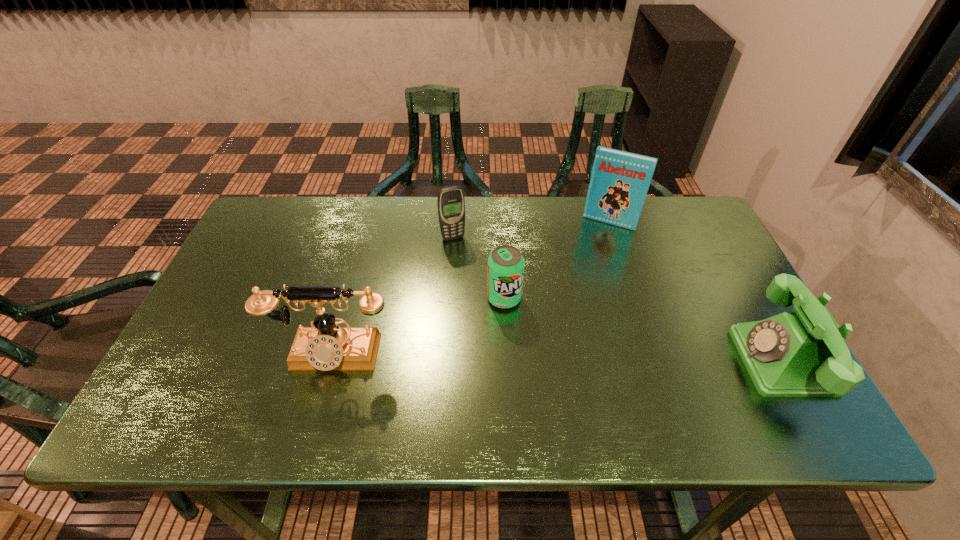
This screenshot has width=960, height=540. In order to click on vacant point located 0.070m on the dial of the shorter telephone in this screenshot , I will do `click(710, 361)`.

This screenshot has height=540, width=960. I want to click on vacant space located on the dial of the shorter telephone, so click(x=715, y=361).

In order to click on free space located on the dial of the shorter telephone in this screenshot , I will do `click(625, 361)`.

Find the location of a particular element. This screenshot has height=540, width=960. free point located on the screen of the second farthest object is located at coordinates (468, 267).

Where is `free space located 0.120m on the screen of the second farthest object`? free space located 0.120m on the screen of the second farthest object is located at coordinates (469, 269).

Image resolution: width=960 pixels, height=540 pixels. I want to click on vacant region located on the screen of the second farthest object, so click(x=486, y=302).

Where is `blank space located on the front cover of the farthest object`? blank space located on the front cover of the farthest object is located at coordinates 570,305.

Locate an element on the screen. vacant space located 0.380m on the front cover of the farthest object is located at coordinates (565, 318).

Where is `vacant space located 0.210m on the front cover of the farthest object`? The height and width of the screenshot is (540, 960). vacant space located 0.210m on the front cover of the farthest object is located at coordinates (583, 274).

Locate an element on the screen. free space located 0.130m on the front-facing side of the pop soda is located at coordinates (540, 347).